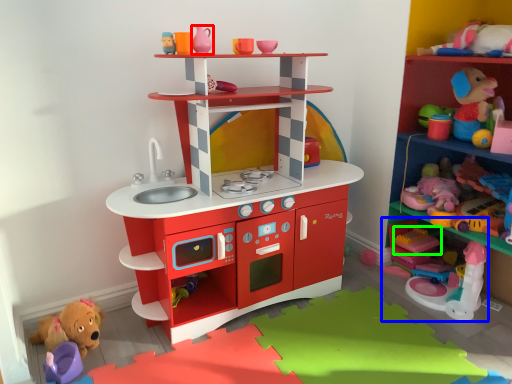
Question: Which object is the farthest from toy (highlighted by a red box)? Choose among these: toy (highlighted by a blue box) or toy (highlighted by a green box).

Choices:
 (A) toy
 (B) toy

Answer: (A)